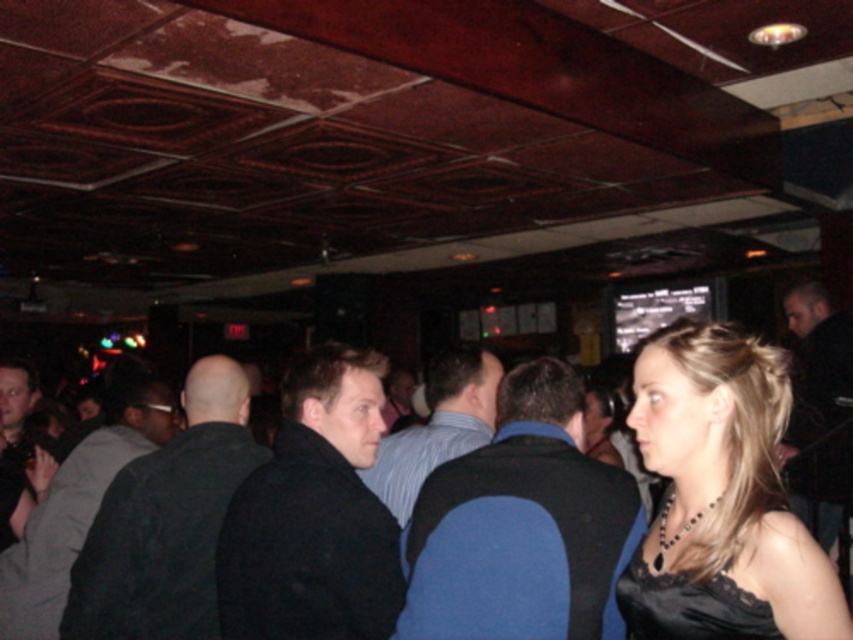
Can you confirm if dark gray vest at center is taller than dark blue shirt at center?

Yes, dark gray vest at center is taller than dark blue shirt at center.

Can you confirm if dark gray vest at center is thinner than dark blue shirt at center?

In fact, dark gray vest at center might be wider than dark blue shirt at center.

Between point (0, 576) and point (393, 486), which one is positioned behind?

The point (0, 576) is more distant.

Identify the location of dark gray vest at center. (76, 509).

Is dark gray sweater at center positioned at the back of black lace dress at lower right?

Yes, dark gray sweater at center is behind black lace dress at lower right.

Does dark gray sweater at center have a lesser height compared to black lace dress at lower right?

No.

This screenshot has width=853, height=640. Describe the element at coordinates (167, 522) in the screenshot. I see `dark gray sweater at center` at that location.

At what (x,y) coordinates should I click in order to perform the action: click on dark gray sweater at center. Please return your answer as a coordinate pair (x, y). The width and height of the screenshot is (853, 640). Looking at the image, I should click on click(x=167, y=522).

Does dark gray sweater at center appear over dark gray vest at center?

Yes.

Does dark gray sweater at center have a greater width compared to dark gray vest at center?

Yes.

Which is behind, point (184, 516) or point (146, 416)?

Point (146, 416)

This screenshot has height=640, width=853. Find the location of `dark gray sweater at center`. dark gray sweater at center is located at coordinates (167, 522).